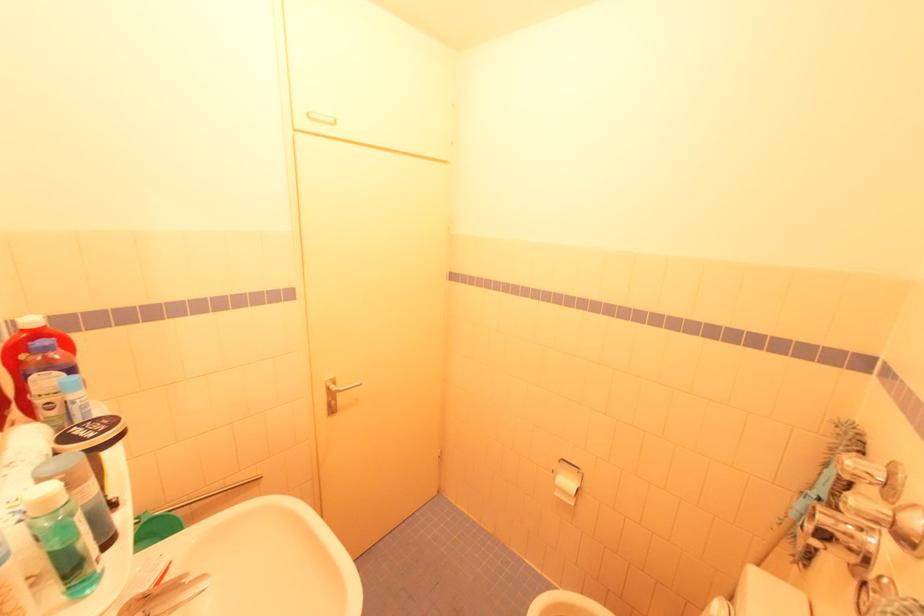
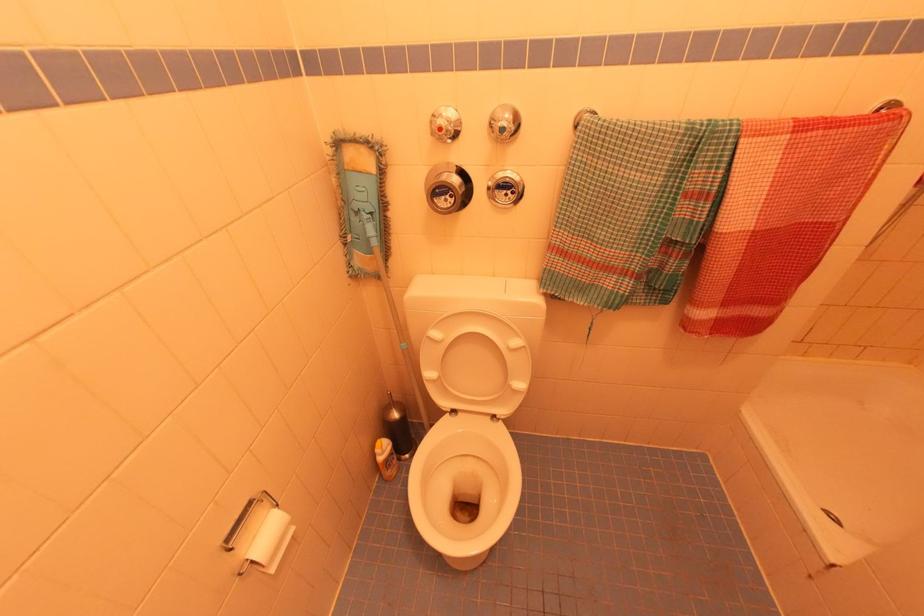
In the second image, find the point that corresponds to pixel 557 495 in the first image.

(274, 570)